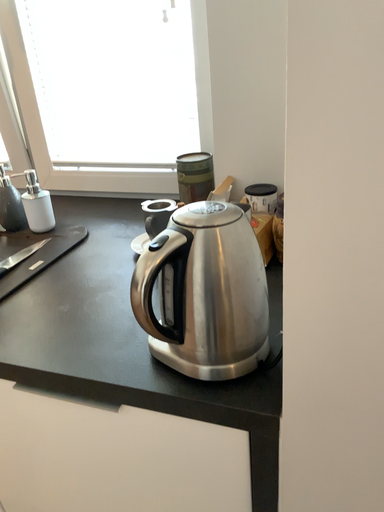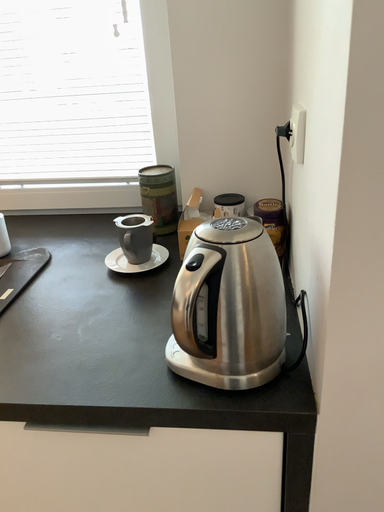
Question: Which way did the camera rotate in the video?

Choices:
 (A) rotated left
 (B) rotated right

Answer: (B)